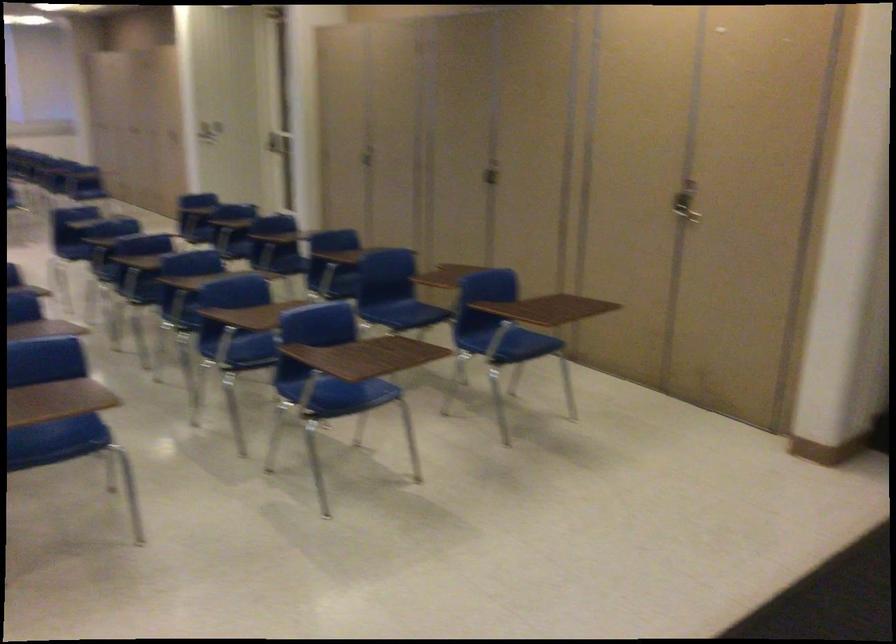
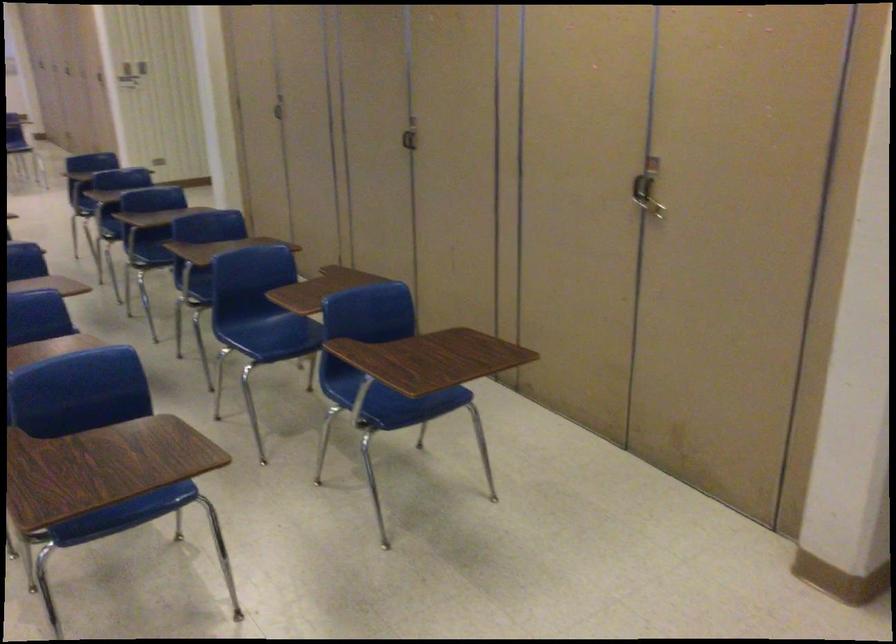
Find the pixel in the second image that matches [487,167] in the first image.

(409, 136)